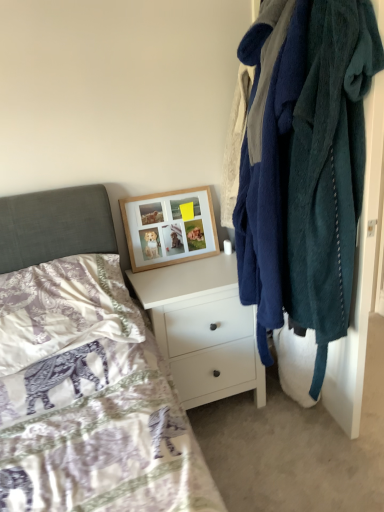
Question: Considering the relative positions of purple satin pillow at lower left and white matte chest of drawers at center in the image provided, is purple satin pillow at lower left behind white matte chest of drawers at center?

Choices:
 (A) yes
 (B) no

Answer: (B)

Question: Considering the relative sizes of purple satin pillow at lower left and white matte chest of drawers at center in the image provided, is purple satin pillow at lower left taller than white matte chest of drawers at center?

Choices:
 (A) no
 (B) yes

Answer: (A)

Question: Can you confirm if purple satin pillow at lower left is bigger than white matte chest of drawers at center?

Choices:
 (A) no
 (B) yes

Answer: (A)

Question: From a real-world perspective, is purple satin pillow at lower left over white matte chest of drawers at center?

Choices:
 (A) no
 (B) yes

Answer: (B)

Question: Does purple satin pillow at lower left have a lesser height compared to white matte chest of drawers at center?

Choices:
 (A) yes
 (B) no

Answer: (A)

Question: Considering the positions of point (196, 357) and point (54, 335), is point (196, 357) closer or farther from the camera than point (54, 335)?

Choices:
 (A) closer
 (B) farther

Answer: (B)

Question: From their relative heights in the image, would you say white matte chest of drawers at center is taller or shorter than purple satin pillow at lower left?

Choices:
 (A) short
 (B) tall

Answer: (B)

Question: In terms of width, does white matte chest of drawers at center look wider or thinner when compared to purple satin pillow at lower left?

Choices:
 (A) thin
 (B) wide

Answer: (B)

Question: From a real-world perspective, is white matte chest of drawers at center above or below purple satin pillow at lower left?

Choices:
 (A) below
 (B) above

Answer: (A)

Question: From the image's perspective, is teal fuzzy robe at right located above or below woodenobject at upper center?

Choices:
 (A) below
 (B) above

Answer: (A)

Question: From a real-world perspective, is teal fuzzy robe at right positioned above or below woodenobject at upper center?

Choices:
 (A) below
 (B) above

Answer: (B)

Question: Considering the positions of teal fuzzy robe at right and woodenobject at upper center in the image, is teal fuzzy robe at right wider or thinner than woodenobject at upper center?

Choices:
 (A) thin
 (B) wide

Answer: (B)

Question: Considering the positions of teal fuzzy robe at right and woodenobject at upper center in the image, is teal fuzzy robe at right bigger or smaller than woodenobject at upper center?

Choices:
 (A) big
 (B) small

Answer: (A)

Question: From a real-world perspective, is white matte chest of drawers at center above or below teal fuzzy robe at right?

Choices:
 (A) below
 (B) above

Answer: (A)

Question: Considering the positions of white matte chest of drawers at center and teal fuzzy robe at right in the image, is white matte chest of drawers at center taller or shorter than teal fuzzy robe at right?

Choices:
 (A) short
 (B) tall

Answer: (A)